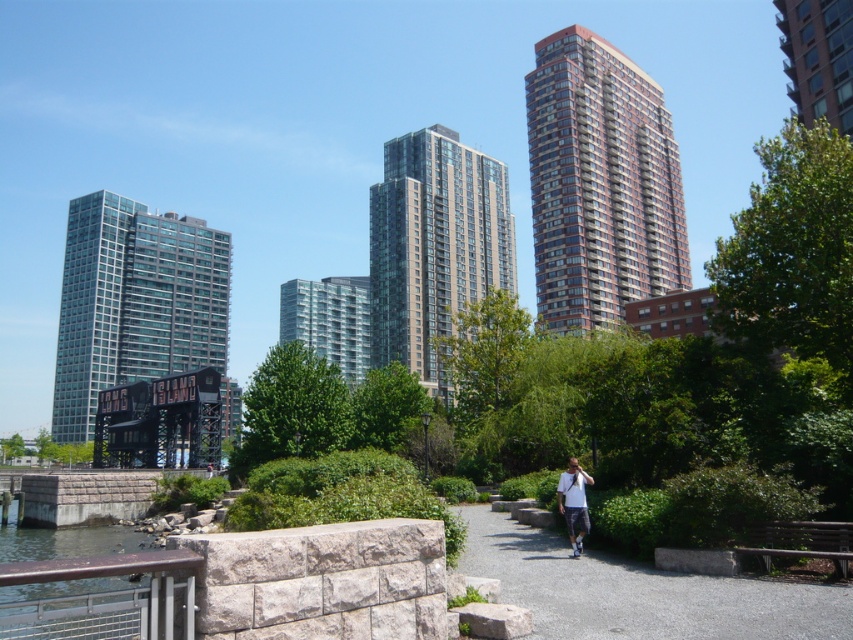
You are standing at the point marked as point (639, 592) in the image. What type of surface are you currently standing on?

You are standing on the gray gravel path at center.

You are standing at the waterfront and want to take a photo of the glassy steel building at center. The camera you have can focus on objects up to 80 meters away. Will the building be in focus?

The glassy steel building at center is 78.37 meters away from camera, which is within the camera focus range of 80 meters. Therefore, the building will be in focus.

You are a drone operator who needs to fly a drone between the glassy steel building at center and the red brick building at upper right. The drone has a maximum flight distance of 85 meters. Based on the scene, can the drone safely complete the flight between these two buildings without exceeding its range?

The glassy steel building at center and red brick building at upper right are 87.10 meters apart from each other. Since the drone can only fly up to 85 meters, it cannot safely complete the flight between them as the distance exceeds its maximum range.